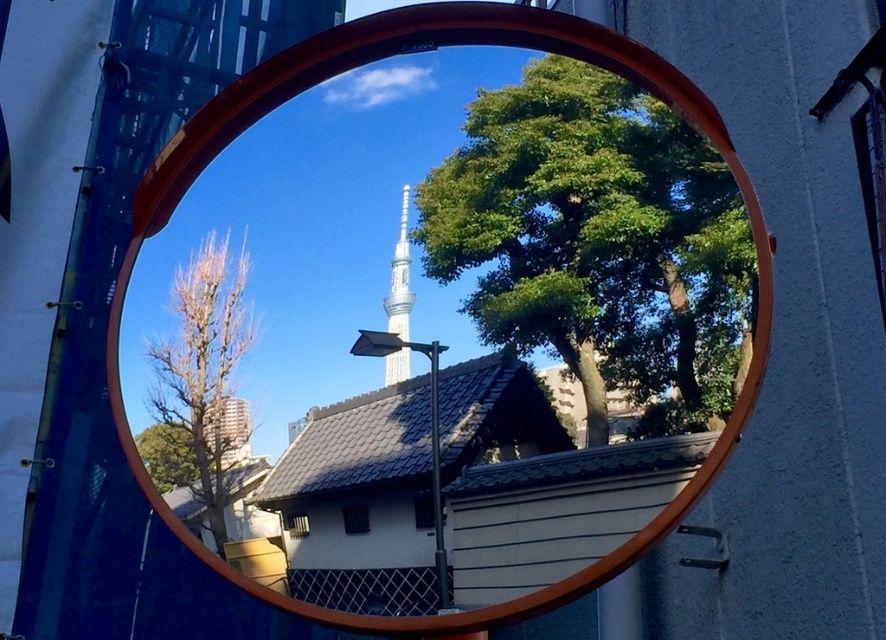
Question: Which point appears farthest from the camera in this image?

Choices:
 (A) tap(219, 394)
 (B) tap(615, 328)
 (C) tap(389, 369)

Answer: (A)

Question: Is green leafy tree at upper center positioned in front of shiny silver tower at center?

Choices:
 (A) no
 (B) yes

Answer: (B)

Question: Which point is closer to the camera?

Choices:
 (A) smooth wooden mirror at center
 (B) shiny silver tower at center

Answer: (A)

Question: Which point is closer to the camera taking this photo?

Choices:
 (A) (391, 276)
 (B) (494, 259)
 (C) (203, 337)
 (D) (122, 404)

Answer: (B)

Question: Is green leafy tree at upper center positioned in front of smooth wooden mirror at center?

Choices:
 (A) yes
 (B) no

Answer: (B)

Question: Can you confirm if green leafy tree at upper center is positioned to the right of shiny silver tower at center?

Choices:
 (A) yes
 (B) no

Answer: (A)